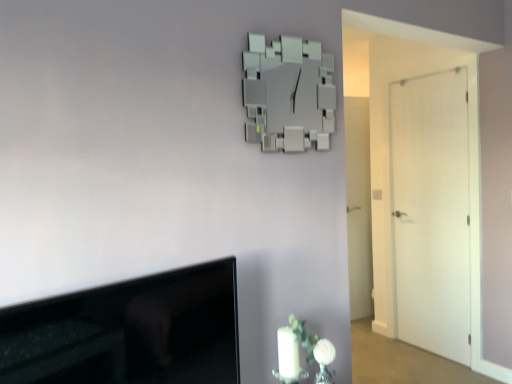
Question: Is point (434, 213) positioned closer to the camera than point (148, 357)?

Choices:
 (A) closer
 (B) farther

Answer: (B)

Question: Is white matte door at right, the 2th door positioned from the back, to the left or to the right of black glossy tv at lower left in the image?

Choices:
 (A) right
 (B) left

Answer: (A)

Question: Which is farther from the white matte vase at lower right?

Choices:
 (A) white matte door at right, the second door when ordered from left to right
 (B) white matte door at right, arranged as the 2th door when viewed from the right
 (C) black glossy tv at lower left
 (D) white matte clock at upper center

Answer: (B)

Question: Based on their relative distances, which object is nearer to the white matte door at right, which ranks as the 1th door in left-to-right order?

Choices:
 (A) black glossy tv at lower left
 (B) white matte clock at upper center
 (C) white matte vase at lower right
 (D) white matte door at right, the 2th door positioned from the back

Answer: (D)